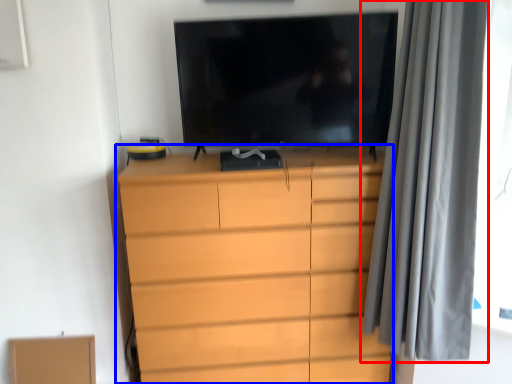
Question: Among these objects, which one is nearest to the camera, curtain (highlighted by a red box) or chest of drawers (highlighted by a blue box)?

Choices:
 (A) curtain
 (B) chest of drawers

Answer: (A)